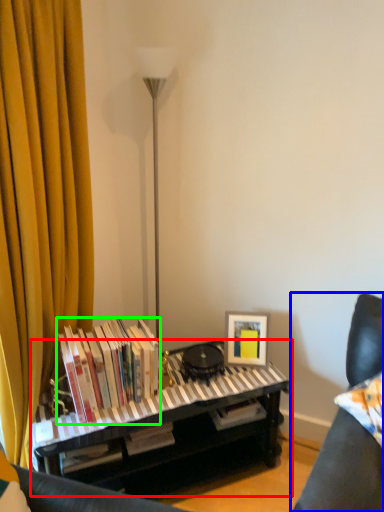
Question: Estimate the real-world distances between objects in this image. Which object is closer to piano (highlighted by a red box), furniture (highlighted by a blue box) or book (highlighted by a green box)?

Choices:
 (A) furniture
 (B) book

Answer: (B)